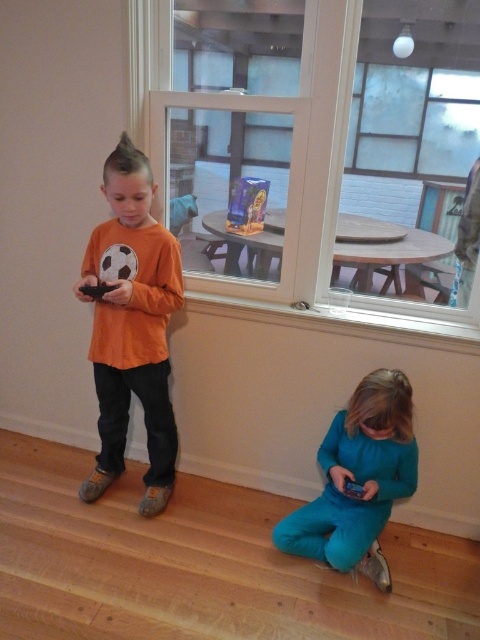
Please provide the coordinates of the orange matte shirt at center in the image. The coordinates should be given as a point with two decimal places separated by a comma.

The orange matte shirt at center is located at point [132,324].

You are a fashion designer observing the two children. You need to determine which item of clothing is larger in size between the orange matte shirt at center and the teal fabric pants at lower center. Based on the description provided, which one is larger?

The orange matte shirt at center is larger than the teal fabric pants at lower center according to the description.

You are a parent trying to ensure your children are getting enough sunlight. You notice the clear glass window at upper center and the teal fabric pants at lower center. Which object is closer to the window to potentially allow sunlight exposure?

The clear glass window at upper center is positioned on the left side of teal fabric pants at lower center, meaning the window is closer to the source of sunlight. However, the teal fabric pants at lower center are positioned to the right of the window, so they may receive sunlight through the window depending on the room layout.